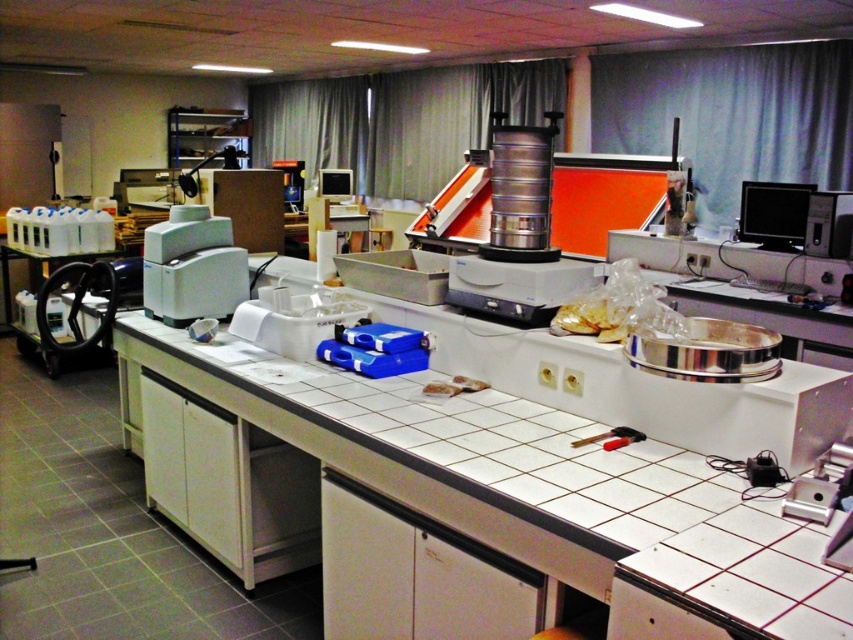
Between point (131, 328) and point (323, 189), which one is positioned behind?

Point (323, 189)

Consider the image. Can you confirm if white tile countertop at center is positioned to the right of matte black monitor at center?

Yes, white tile countertop at center is to the right of matte black monitor at center.

Locate an element on the screen. This screenshot has height=640, width=853. white tile countertop at center is located at coordinates (540, 488).

Is matte black monitor at upper right to the left of black plastic monitor at upper right from the viewer's perspective?

Indeed, matte black monitor at upper right is positioned on the left side of black plastic monitor at upper right.

In the scene shown: Is matte black monitor at upper right bigger than black plastic monitor at upper right?

Yes, matte black monitor at upper right is bigger than black plastic monitor at upper right.

Image resolution: width=853 pixels, height=640 pixels. Identify the location of matte black monitor at upper right. (773, 212).

Locate an element on the screen. Image resolution: width=853 pixels, height=640 pixels. black plastic monitor at upper right is located at coordinates (828, 225).

Between black plastic monitor at upper right and red plastic tool at center, which one is positioned lower?

red plastic tool at center

Is point (834, 228) positioned in front of point (614, 428)?

No, (834, 228) is behind (614, 428).

Locate an element on the screen. black plastic monitor at upper right is located at coordinates 828,225.